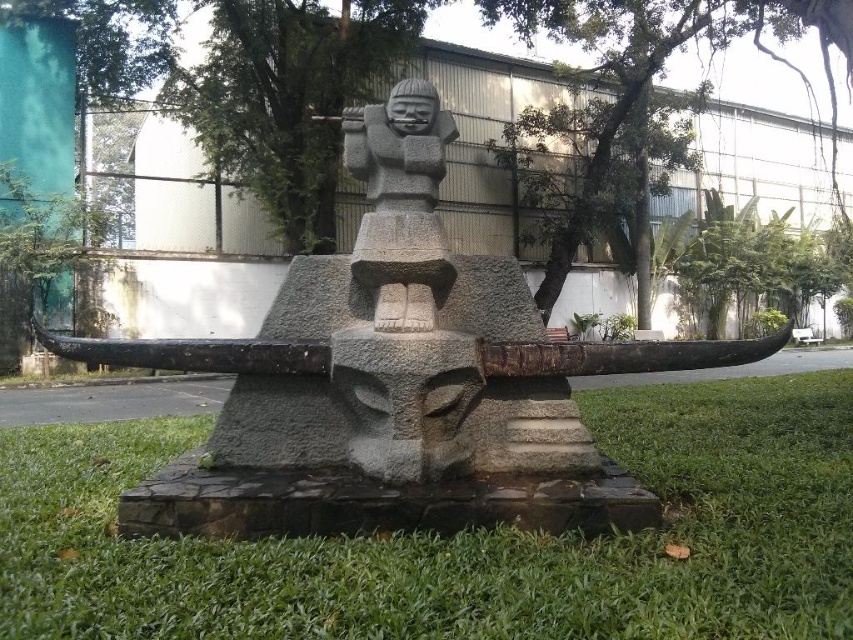
Question: Does green grass at center appear under gray stone statue at center?

Choices:
 (A) no
 (B) yes

Answer: (B)

Question: Which point appears closest to the camera in this image?

Choices:
 (A) (44, 460)
 (B) (463, 349)

Answer: (B)

Question: Which object appears closest to the camera in this image?

Choices:
 (A) green grass at center
 (B) gray stone statue at center

Answer: (A)

Question: Does green grass at center come in front of gray stone statue at center?

Choices:
 (A) yes
 (B) no

Answer: (A)

Question: Can you confirm if green grass at center is smaller than gray stone statue at center?

Choices:
 (A) no
 (B) yes

Answer: (B)